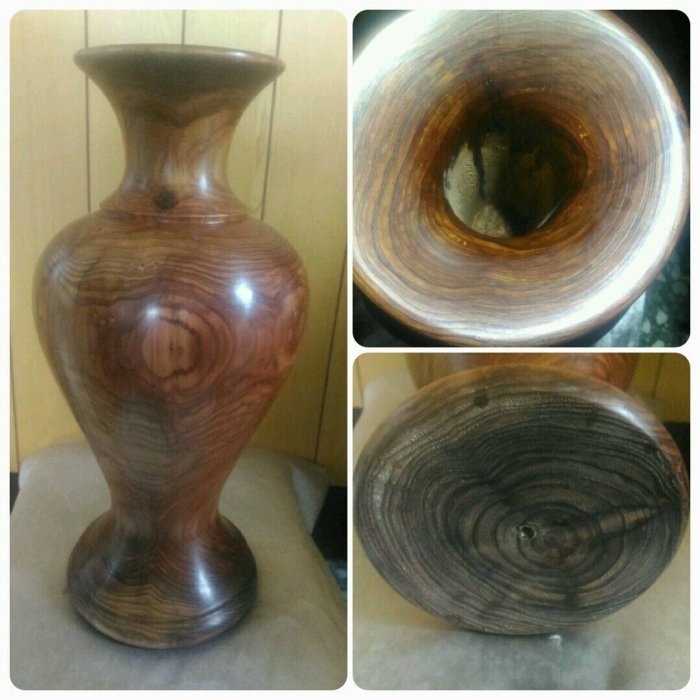
The image size is (700, 700). Identify the location of brown pot. (196, 358).